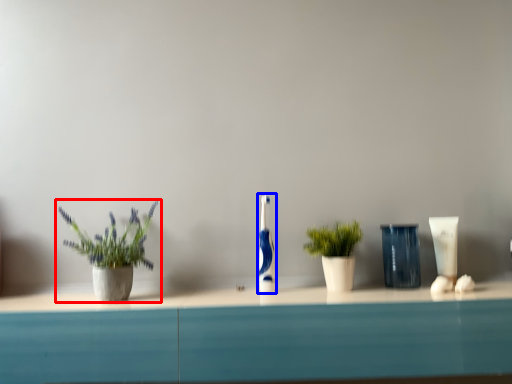
Question: Among these objects, which one is nearest to the camera, houseplant (highlighted by a red box) or toothbrush (highlighted by a blue box)?

Choices:
 (A) houseplant
 (B) toothbrush

Answer: (A)